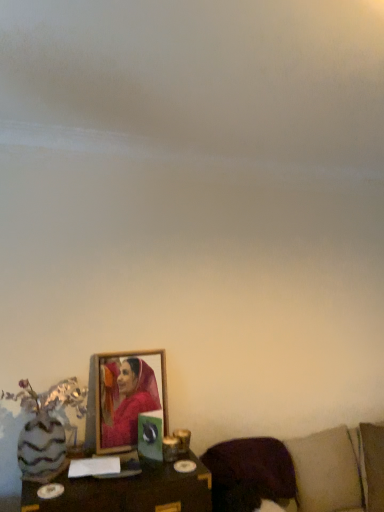
Question: Is wooden table at lower center positioned behind brown fabric couch at lower right?

Choices:
 (A) no
 (B) yes

Answer: (B)

Question: Considering the relative sizes of wooden table at lower center and brown fabric couch at lower right in the image provided, is wooden table at lower center taller than brown fabric couch at lower right?

Choices:
 (A) no
 (B) yes

Answer: (A)

Question: Can you confirm if wooden table at lower center is bigger than brown fabric couch at lower right?

Choices:
 (A) no
 (B) yes

Answer: (A)

Question: From the image's perspective, would you say wooden table at lower center is shown under brown fabric couch at lower right?

Choices:
 (A) no
 (B) yes

Answer: (A)

Question: Is wooden table at lower center placed right next to brown fabric couch at lower right?

Choices:
 (A) yes
 (B) no

Answer: (B)

Question: Considering the positions of brown fabric couch at lower right and wooden table at lower center in the image, is brown fabric couch at lower right taller or shorter than wooden table at lower center?

Choices:
 (A) tall
 (B) short

Answer: (A)

Question: Is point (251, 487) positioned closer to the camera than point (99, 510)?

Choices:
 (A) farther
 (B) closer

Answer: (A)

Question: Is brown fabric couch at lower right spatially inside wooden table at lower center, or outside of it?

Choices:
 (A) inside
 (B) outside

Answer: (B)

Question: Looking at their shapes, would you say brown fabric couch at lower right is wider or thinner than wooden table at lower center?

Choices:
 (A) wide
 (B) thin

Answer: (A)

Question: Is wooden table at lower center situated inside wooden frame at center or outside?

Choices:
 (A) outside
 (B) inside

Answer: (A)

Question: In terms of height, does wooden table at lower center look taller or shorter compared to wooden frame at center?

Choices:
 (A) tall
 (B) short

Answer: (B)

Question: Considering the relative positions of wooden table at lower center and wooden frame at center in the image provided, is wooden table at lower center to the left or to the right of wooden frame at center?

Choices:
 (A) left
 (B) right

Answer: (A)

Question: Considering the positions of wooden table at lower center and wooden frame at center in the image, is wooden table at lower center wider or thinner than wooden frame at center?

Choices:
 (A) thin
 (B) wide

Answer: (B)

Question: In the image, is purple fabric pillow at lower right on the left side or the right side of wooden table at lower center?

Choices:
 (A) left
 (B) right

Answer: (B)

Question: Looking at the image, does purple fabric pillow at lower right seem bigger or smaller compared to wooden table at lower center?

Choices:
 (A) small
 (B) big

Answer: (A)